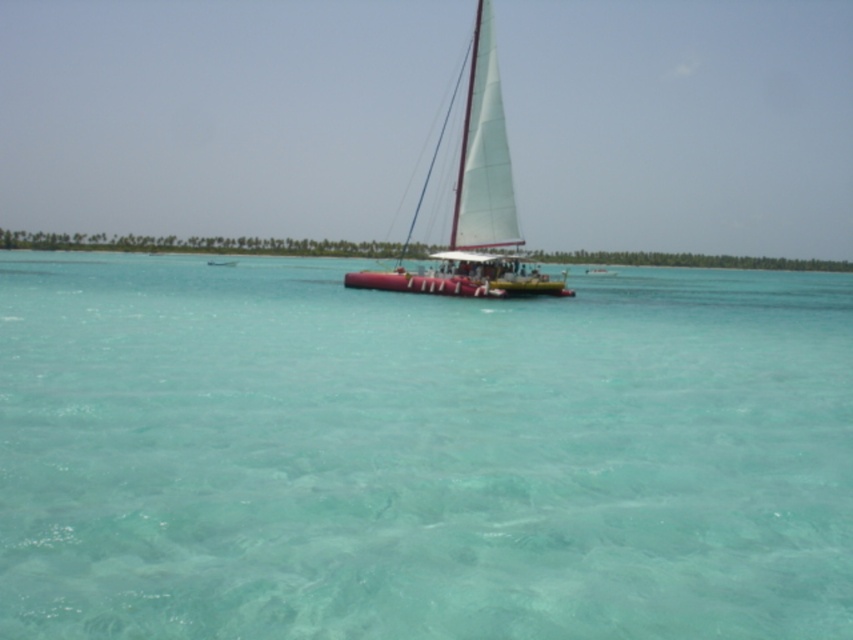
Is clear water at center wider than white matte sailboat at center?

Correct, the width of clear water at center exceeds that of white matte sailboat at center.

Is point (437, 461) closer to camera compared to point (465, 280)?

That is True.

Does point (146, 486) lie behind point (546, 291)?

No, (146, 486) is in front of (546, 291).

Locate an element on the screen. The width and height of the screenshot is (853, 640). clear water at center is located at coordinates (421, 454).